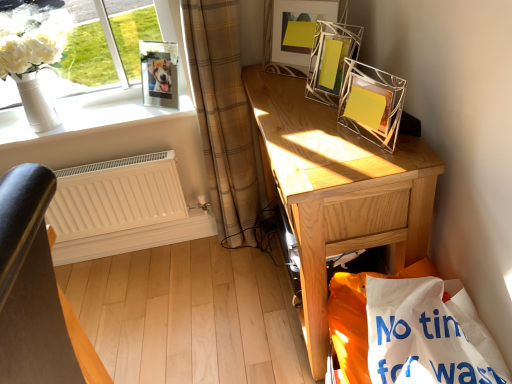
Question: Is light brown wooden desk at right far away from white matte radiator at lower left?

Choices:
 (A) no
 (B) yes

Answer: (A)

Question: Is light brown wooden desk at right smaller than white matte radiator at lower left?

Choices:
 (A) no
 (B) yes

Answer: (A)

Question: Can you confirm if light brown wooden desk at right is wider than white matte radiator at lower left?

Choices:
 (A) no
 (B) yes

Answer: (B)

Question: Considering the relative sizes of light brown wooden desk at right and white matte radiator at lower left in the image provided, is light brown wooden desk at right taller than white matte radiator at lower left?

Choices:
 (A) yes
 (B) no

Answer: (A)

Question: Is light brown wooden desk at right outside of white matte radiator at lower left?

Choices:
 (A) no
 (B) yes

Answer: (B)

Question: Is light brown wooden desk at right closer to the viewer compared to white matte radiator at lower left?

Choices:
 (A) yes
 (B) no

Answer: (A)

Question: Can you confirm if white paper shopping bag at lower right is shorter than white matte radiator at lower left?

Choices:
 (A) no
 (B) yes

Answer: (B)

Question: Is white paper shopping bag at lower right at the right side of white matte radiator at lower left?

Choices:
 (A) no
 (B) yes

Answer: (B)

Question: Is white paper shopping bag at lower right not close to white matte radiator at lower left?

Choices:
 (A) no
 (B) yes

Answer: (B)

Question: From a real-world perspective, is white paper shopping bag at lower right positioned under white matte radiator at lower left based on gravity?

Choices:
 (A) yes
 (B) no

Answer: (B)

Question: Does white paper shopping bag at lower right have a greater width compared to white matte radiator at lower left?

Choices:
 (A) yes
 (B) no

Answer: (A)

Question: Does white paper shopping bag at lower right lie in front of white matte radiator at lower left?

Choices:
 (A) yes
 (B) no

Answer: (A)

Question: Considering the relative sizes of light brown wooden desk at right and metallic wire picture frame at upper right, arranged as the 1th picture frame when viewed from the right, in the image provided, is light brown wooden desk at right bigger than metallic wire picture frame at upper right, arranged as the 1th picture frame when viewed from the right,?

Choices:
 (A) no
 (B) yes

Answer: (B)